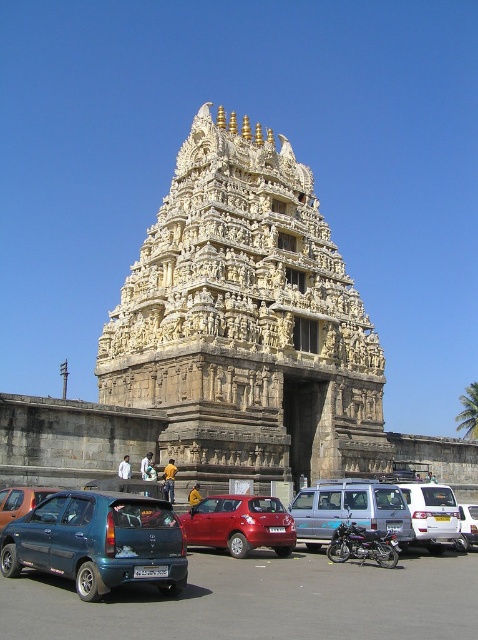
You are a visitor at the temple and want to park your car near the white cloth at center. Is the metallic blue hatchback at lower left blocking your parking spot?

The metallic blue hatchback at lower left is positioned on the right side of white cloth at center, so it is blocking the parking spot near the white cloth at center.

You are standing at the entrance of the temple and want to locate your metallic blue hatchback at lower left. According to the coordinates provided, where should you look relative to your current position?

The metallic blue hatchback at lower left is located at coordinates point (x=98, y=541), which means it is positioned to the lower left relative to your current position at the temple entrance.